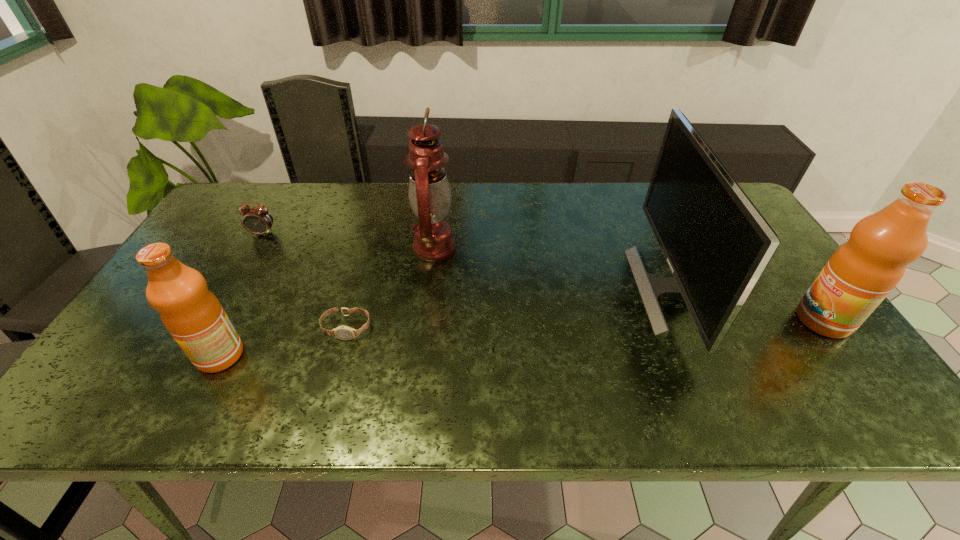
Locate an element on the screen. vacant region located 0.160m on the label side of the fourth tallest object is located at coordinates (127, 355).

You are a GUI agent. You are given a task and a screenshot of the screen. Output one action in this format:
    pyautogui.click(x=<x>, y=<y>)
    Task: Click on the free space located on the label side of the fourth tallest object
    
    Given the screenshot: What is the action you would take?
    pyautogui.click(x=162, y=355)

You are a GUI agent. You are given a task and a screenshot of the screen. Output one action in this format:
    pyautogui.click(x=<x>, y=<y>)
    Task: Click on the vacant point located 0.360m on the label side of the taller fruit juice
    This screenshot has height=540, width=960.
    Given the screenshot: What is the action you would take?
    pyautogui.click(x=652, y=320)

Image resolution: width=960 pixels, height=540 pixels. Identify the location of vacant space located on the label side of the taller fruit juice. (761, 320).

Identify the location of vacant space situated 0.340m on the label side of the taller fruit juice. (660, 320).

You are a GUI agent. You are given a task and a screenshot of the screen. Output one action in this format:
    pyautogui.click(x=<x>, y=<y>)
    Task: Click on the vacant region located 0.270m on the face of the alarm clock
    The width and height of the screenshot is (960, 540).
    Given the screenshot: What is the action you would take?
    pyautogui.click(x=223, y=304)

At what (x,y) coordinates should I click in order to perform the action: click on vacant space situated on the right of the third object from right to left. Please return your answer as a coordinate pair (x, y). Image resolution: width=960 pixels, height=540 pixels. Looking at the image, I should click on (498, 247).

Where is `vacant space located on the screen side of the fifth object from left to right`? This screenshot has width=960, height=540. vacant space located on the screen side of the fifth object from left to right is located at coordinates (506, 289).

This screenshot has width=960, height=540. Identify the location of free space located on the screen side of the fifth object from left to right. (555, 289).

At what (x,y) coordinates should I click in order to perform the action: click on vacant space located 0.100m on the screen side of the fifth object from left to right. Please return your answer as a coordinate pair (x, y). Looking at the image, I should click on (600, 289).